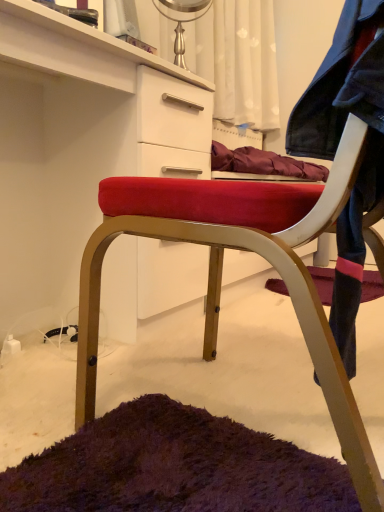
Question: Is velvet red chair at center at the back of velvet red chair at center?

Choices:
 (A) yes
 (B) no

Answer: (B)

Question: Is velvet red chair at center positioned beyond the bounds of velvet red chair at center?

Choices:
 (A) yes
 (B) no

Answer: (A)

Question: From the image's perspective, is velvet red chair at center beneath velvet red chair at center?

Choices:
 (A) yes
 (B) no

Answer: (A)

Question: From a real-world perspective, is velvet red chair at center over velvet red chair at center?

Choices:
 (A) yes
 (B) no

Answer: (A)

Question: Does velvet red chair at center have a greater width compared to velvet red chair at center?

Choices:
 (A) yes
 (B) no

Answer: (A)

Question: Is velvet red chair at center directly adjacent to velvet red chair at center?

Choices:
 (A) no
 (B) yes

Answer: (A)

Question: Are velvet red chair at center and velvet red chair at center beside each other?

Choices:
 (A) yes
 (B) no

Answer: (B)

Question: Does velvet red chair at center appear on the left side of velvet red chair at center?

Choices:
 (A) yes
 (B) no

Answer: (A)

Question: Is velvet red chair at center to the right of velvet red chair at center from the viewer's perspective?

Choices:
 (A) yes
 (B) no

Answer: (B)

Question: Is velvet red chair at center smaller than velvet red chair at center?

Choices:
 (A) yes
 (B) no

Answer: (B)

Question: From a real-world perspective, does velvet red chair at center sit lower than velvet red chair at center?

Choices:
 (A) yes
 (B) no

Answer: (A)

Question: Are velvet red chair at center and velvet red chair at center far apart?

Choices:
 (A) yes
 (B) no

Answer: (B)

Question: Does faded denim jacket at lower right have a lesser width compared to velvet red chair at center?

Choices:
 (A) yes
 (B) no

Answer: (A)